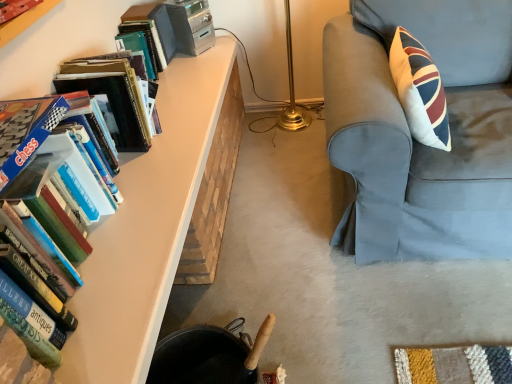
What do you see at coordinates (58, 44) in the screenshot? Image resolution: width=512 pixels, height=384 pixels. I see `hardcover books at left, positioned as the 1th book in bottom-to-top order` at bounding box center [58, 44].

Where is `matte white table at left`? The height and width of the screenshot is (384, 512). matte white table at left is located at coordinates (147, 228).

The height and width of the screenshot is (384, 512). In order to click on hardcover books at left, which ranks as the 1th book in front-to-back order in this screenshot , I will do `click(58, 44)`.

Is point (159, 165) closer or farther from the camera than point (17, 20)?

Point (159, 165) appears to be farther away from the viewer than point (17, 20).

From the image's perspective, is matte white table at left on top of matte plastic bookcase at upper left?

Incorrect, from the image's perspective, matte white table at left is lower than matte plastic bookcase at upper left.

Which object is positioned more to the right, matte white table at left or matte plastic bookcase at upper left?

matte white table at left is more to the right.

Considering the sizes of objects matte white table at left and matte plastic bookcase at upper left in the image provided, who is smaller, matte white table at left or matte plastic bookcase at upper left?

With smaller size is matte plastic bookcase at upper left.

Considering the relative positions of gold metallic table lamp at center and matte white table at left in the image provided, is gold metallic table lamp at center in front of matte white table at left?

No, it is not.

From the image's perspective, is gold metallic table lamp at center below matte white table at left?

Incorrect, from the image's perspective, gold metallic table lamp at center is higher than matte white table at left.

Is gold metallic table lamp at center situated inside matte white table at left or outside?

gold metallic table lamp at center is located beyond the bounds of matte white table at left.

Does matte white table at left appear on the left side of hardcover books at left, which ranks as the 1th book in front-to-back order?

In fact, matte white table at left is to the right of hardcover books at left, which ranks as the 1th book in front-to-back order.

Considering the sizes of objects matte white table at left and hardcover books at left, positioned as the 1th book in bottom-to-top order, in the image provided, who is taller, matte white table at left or hardcover books at left, positioned as the 1th book in bottom-to-top order,?

Standing taller between the two is hardcover books at left, positioned as the 1th book in bottom-to-top order.

Is matte white table at left positioned with its back to hardcover books at left, positioned as the second book in top-to-bottom order?

No, matte white table at left is not facing the opposite direction of hardcover books at left, positioned as the second book in top-to-bottom order.

Find the location of a particular element. the 2nd book to the left of the matte white table at left, counting from the anchor's position is located at coordinates (58, 44).

From the image's perspective, is light blue fabric chair at right located above or below hardcover book at upper left, positioned as the 1th book in back-to-front order?

light blue fabric chair at right is below hardcover book at upper left, positioned as the 1th book in back-to-front order.

In terms of size, does light blue fabric chair at right appear bigger or smaller than hardcover book at upper left, which is the first book in top-to-bottom order?

Considering their sizes, light blue fabric chair at right takes up more space than hardcover book at upper left, which is the first book in top-to-bottom order.

Which object is closer to the camera taking this photo, light blue fabric chair at right or hardcover book at upper left, which is the second book in front-to-back order?

light blue fabric chair at right.

Can you confirm if light blue fabric chair at right is thinner than hardcover book at upper left, which is the first book in top-to-bottom order?

In fact, light blue fabric chair at right might be wider than hardcover book at upper left, which is the first book in top-to-bottom order.

Are matte white table at left and hardcover book at upper left, positioned as the 2th book in bottom-to-top order, far apart?

They are positioned close to each other.

Is point (147, 234) positioned before point (132, 31)?

Yes.

Considering the relative sizes of matte white table at left and hardcover book at upper left, positioned as the 1th book in back-to-front order, in the image provided, is matte white table at left taller than hardcover book at upper left, positioned as the 1th book in back-to-front order,?

No.

From a real-world perspective, which object rests below the other?

From a 3D spatial view, matte white table at left is below.

Considering the sizes of objects matte plastic bookcase at upper left and hardcover book at upper left, positioned as the 1th book in back-to-front order, in the image provided, who is wider, matte plastic bookcase at upper left or hardcover book at upper left, positioned as the 1th book in back-to-front order,?

hardcover book at upper left, positioned as the 1th book in back-to-front order.

Considering the relative sizes of matte plastic bookcase at upper left and hardcover book at upper left, which is the first book in top-to-bottom order, in the image provided, is matte plastic bookcase at upper left taller than hardcover book at upper left, which is the first book in top-to-bottom order,?

In fact, matte plastic bookcase at upper left may be shorter than hardcover book at upper left, which is the first book in top-to-bottom order.

Is matte plastic bookcase at upper left turned away from hardcover book at upper left, positioned as the 1th book in back-to-front order?

No, hardcover book at upper left, positioned as the 1th book in back-to-front order, is not at the back of matte plastic bookcase at upper left.

From the picture: Is hardcover books at left, positioned as the second book in top-to-bottom order, with matte white table at left?

No.

From a real-world perspective, is hardcover books at left, positioned as the 1th book in bottom-to-top order, on matte white table at left?

Yes, from a real-world perspective, hardcover books at left, positioned as the 1th book in bottom-to-top order, is over matte white table at left

Which object is closer to the camera, hardcover books at left, which ranks as the 1th book in front-to-back order, or matte white table at left?

hardcover books at left, which ranks as the 1th book in front-to-back order, is more forward.

Looking at this image, do you think hardcover books at left, positioned as the second book in top-to-bottom order, is within matte white table at left, or outside of it?

hardcover books at left, positioned as the second book in top-to-bottom order, is outside matte white table at left.

In the image, there is a matte white table at left. Where is `bookcase above it (from the image's perspective)`? Image resolution: width=512 pixels, height=384 pixels. bookcase above it (from the image's perspective) is located at coordinates (24, 21).

Locate an element on the screen. This screenshot has height=384, width=512. table above the gold metallic table lamp at center (from a real-world perspective) is located at coordinates (147, 228).

Which object lies nearer to the anchor point matte plastic bookcase at upper left, matte white table at left or gold metallic table lamp at center?

matte white table at left lies closer to matte plastic bookcase at upper left than the other object.

Looking at the image, which one is located further to light blue fabric chair at right, matte white table at left or hardcover book at upper left, positioned as the 1th book in back-to-front order?

hardcover book at upper left, positioned as the 1th book in back-to-front order, is further to light blue fabric chair at right.

When comparing their distances from hardcover book at upper left, positioned as the 1th book in back-to-front order, does light blue fabric chair at right or matte white table at left seem closer?

The object closer to hardcover book at upper left, positioned as the 1th book in back-to-front order, is matte white table at left.

Considering their positions, is gold metallic table lamp at center positioned closer to light blue fabric chair at right than matte white table at left?

matte white table at left.

Which object lies further to the anchor point hardcover book at upper left, positioned as the 1th book in back-to-front order, matte plastic bookcase at upper left or light blue fabric chair at right?

The object further to hardcover book at upper left, positioned as the 1th book in back-to-front order, is light blue fabric chair at right.

Based on the photo, considering their positions, is hardcover books at left, positioned as the 1th book in bottom-to-top order, positioned closer to light blue fabric chair at right than matte white table at left?

matte white table at left.

Based on their spatial positions, is light blue fabric chair at right or hardcover book at upper left, positioned as the 1th book in back-to-front order, closer to matte white table at left?

The object closer to matte white table at left is hardcover book at upper left, positioned as the 1th book in back-to-front order.

Looking at this image, when comparing their distances from matte white table at left, does gold metallic table lamp at center or matte plastic bookcase at upper left seem closer?

Based on the image, matte plastic bookcase at upper left appears to be nearer to matte white table at left.

Where is `table between matte plastic bookcase at upper left and hardcover books at left, which ranks as the 1th book in front-to-back order, in the up-down direction`? This screenshot has height=384, width=512. table between matte plastic bookcase at upper left and hardcover books at left, which ranks as the 1th book in front-to-back order, in the up-down direction is located at coordinates (147, 228).

Where is `table between hardcover books at left, which appears as the 2th book when viewed from the back, and gold metallic table lamp at center, along the z-axis`? This screenshot has width=512, height=384. table between hardcover books at left, which appears as the 2th book when viewed from the back, and gold metallic table lamp at center, along the z-axis is located at coordinates (147, 228).

Find the location of a particular element. table between matte plastic bookcase at upper left and hardcover book at upper left, which is the second book in front-to-back order, along the z-axis is located at coordinates (147, 228).

You are a GUI agent. You are given a task and a screenshot of the screen. Output one action in this format:
    pyautogui.click(x=<x>, y=<y>)
    Task: Click on the table lamp located between matte plastic bookcase at upper left and hardcover book at upper left, which is the first book in top-to-bottom order, in the depth direction
    This screenshot has height=384, width=512.
    Given the screenshot: What is the action you would take?
    pyautogui.click(x=289, y=91)